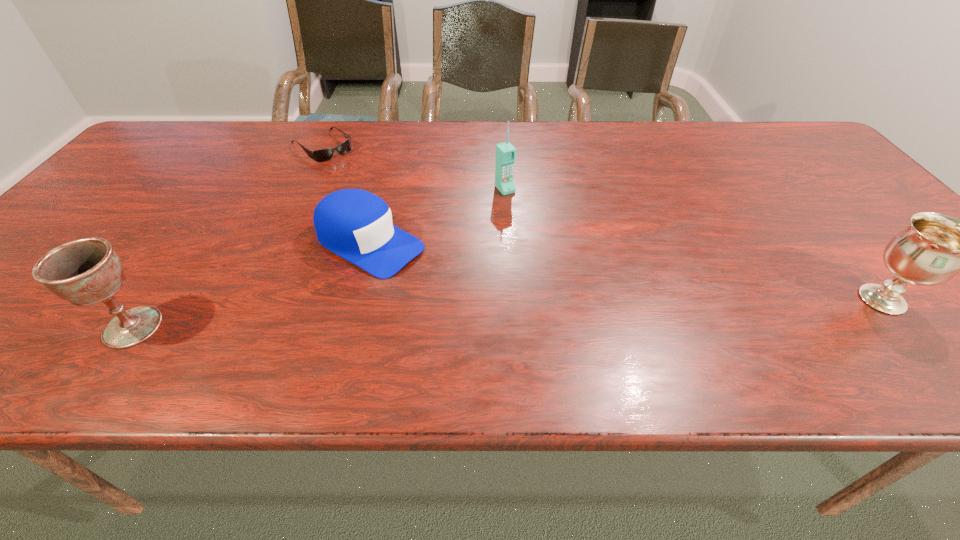
I want to click on vacant region between the shortest object and the left chalice, so click(228, 237).

In order to click on vacant space that is in between the second farthest object and the fourth tallest object in this screenshot , I will do `click(437, 217)`.

I want to click on free space between the sunglasses and the leftmost object, so click(228, 237).

Identify the location of unoccupied position between the second object from right to left and the right chalice. The height and width of the screenshot is (540, 960). (693, 244).

You are a GUI agent. You are given a task and a screenshot of the screen. Output one action in this format:
    pyautogui.click(x=<x>, y=<y>)
    Task: Click on the free space that is in between the right chalice and the left chalice
    The image size is (960, 540).
    Given the screenshot: What is the action you would take?
    pyautogui.click(x=508, y=313)

This screenshot has width=960, height=540. I want to click on free area in between the second shortest object and the left chalice, so click(x=252, y=286).

You are a GUI agent. You are given a task and a screenshot of the screen. Output one action in this format:
    pyautogui.click(x=<x>, y=<y>)
    Task: Click on the vacant space in between the fourth object from left to right and the left chalice
    This screenshot has height=540, width=960.
    Given the screenshot: What is the action you would take?
    pyautogui.click(x=319, y=258)

At what (x,y) coordinates should I click in order to perform the action: click on blank region between the rightmost object and the cellular telephone. Please return your answer as a coordinate pair (x, y). This screenshot has height=540, width=960. Looking at the image, I should click on (693, 244).

Identify which object is located as the second nearest to the second shortest object. Please provide its 2D coordinates. Your answer should be formatted as a tuple, i.e. [(x, y)], where the tuple contains the x and y coordinates of a point satisfying the conditions above.

[(322, 155)]

Where is `the closest object relative to the leftmost object`? The height and width of the screenshot is (540, 960). the closest object relative to the leftmost object is located at coordinates (355, 224).